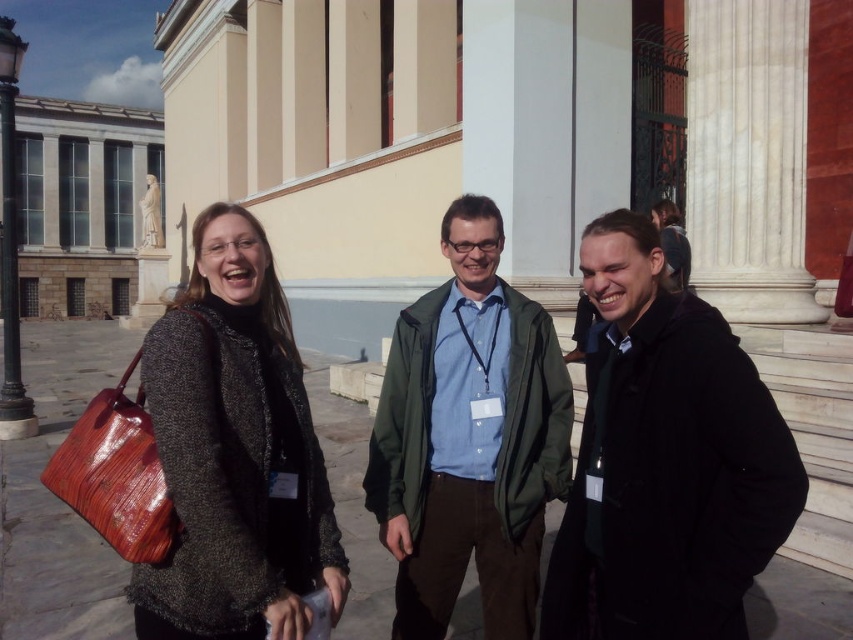
Does black matte jacket at center have a lesser height compared to knitted gray sweater at center?

Indeed, black matte jacket at center has a lesser height compared to knitted gray sweater at center.

The image size is (853, 640). Find the location of `black matte jacket at center`. black matte jacket at center is located at coordinates (665, 460).

At what (x,y) coordinates should I click in order to perform the action: click on black matte jacket at center. Please return your answer as a coordinate pair (x, y). Looking at the image, I should click on (665, 460).

Consider the image. Does knitted gray sweater at center have a greater height compared to green matte jacket at center?

Correct, knitted gray sweater at center is much taller as green matte jacket at center.

Consider the image. Is knitted gray sweater at center closer to camera compared to green matte jacket at center?

Yes, it is in front of green matte jacket at center.

Who is more distant from viewer, (271, 340) or (519, 536)?

Positioned behind is point (519, 536).

The image size is (853, 640). I want to click on knitted gray sweater at center, so click(234, 452).

Is black matte jacket at center below green matte jacket at center?

Indeed, black matte jacket at center is positioned under green matte jacket at center.

Does point (744, 464) come farther from viewer compared to point (494, 557)?

No, (744, 464) is in front of (494, 557).

I want to click on black matte jacket at center, so click(x=665, y=460).